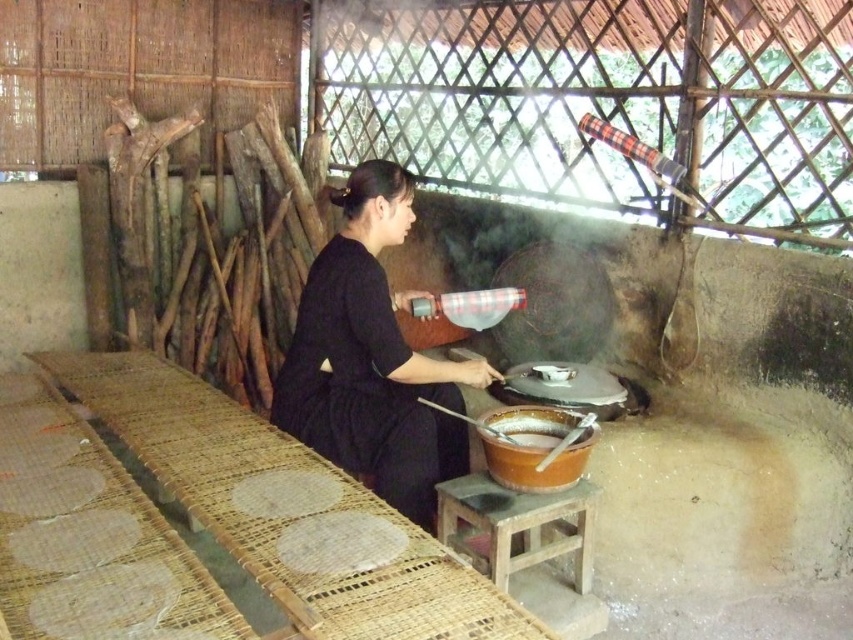
Question: Is wooden stool at center below brown matte wok at center?

Choices:
 (A) yes
 (B) no

Answer: (A)

Question: Which is farther from the black matte dress at center?

Choices:
 (A) wooden stool at center
 (B) brown matte wok at center

Answer: (B)

Question: Which point is farther from the camera taking this photo?

Choices:
 (A) (508, 563)
 (B) (581, 456)

Answer: (B)

Question: Which point is farther to the camera?

Choices:
 (A) wooden stool at center
 (B) black matte dress at center

Answer: (B)

Question: Can you confirm if wooden stool at center is smaller than brown matte wok at center?

Choices:
 (A) yes
 (B) no

Answer: (B)

Question: Can you confirm if black matte dress at center is positioned to the left of brown matte wok at center?

Choices:
 (A) no
 (B) yes

Answer: (B)